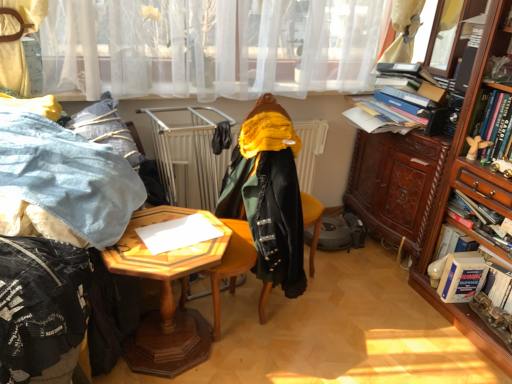
The image size is (512, 384). I want to click on velvet-like green coat at center, so click(x=268, y=198).

This screenshot has width=512, height=384. Describe the element at coordinates (268, 198) in the screenshot. I see `velvet-like green coat at center` at that location.

Where is `velvet black coat at center`? velvet black coat at center is located at coordinates (265, 208).

Looking at this image, how much space does wooden cabinet at right, marked as the second cabinetry in a back-to-front arrangement, occupy vertically?

The height of wooden cabinet at right, marked as the second cabinetry in a back-to-front arrangement, is 4.88 feet.

You are a GUI agent. You are given a task and a screenshot of the screen. Output one action in this format:
    pyautogui.click(x=<x>, y=<y>)
    Task: Click on the wooden hexagonal table at center
    The width and height of the screenshot is (512, 384).
    Given the screenshot: What is the action you would take?
    pyautogui.click(x=166, y=294)

From the image's perspective, which one is positioned lower, hardcover book at right, the 3th book from the bottom, or white sheer curtain at upper center?

From the image's view, hardcover book at right, the 3th book from the bottom, is below.

How much distance is there between hardcover book at right, acting as the 2th book starting from the top, and white sheer curtain at upper center?

A distance of 4.28 feet exists between hardcover book at right, acting as the 2th book starting from the top, and white sheer curtain at upper center.

Is hardcover book at right, the 3th book from the bottom, looking in the opposite direction of white sheer curtain at upper center?

No, hardcover book at right, the 3th book from the bottom, is not facing away from white sheer curtain at upper center.

Would you say hardcover book at right, the 3th book from the bottom, contains white sheer curtain at upper center?

No, white sheer curtain at upper center is not a part of hardcover book at right, the 3th book from the bottom.

Consider the image. Which point is more forward, (465,329) or (478,260)?

The point (478,260) is in front.

How many degrees apart are the facing directions of wooden cabinet at right, acting as the 1th cabinetry starting from the front, and white cardboard book at right, the 2th book positioned from the bottom?

The angle between the facing direction of wooden cabinet at right, acting as the 1th cabinetry starting from the front, and the facing direction of white cardboard book at right, the 2th book positioned from the bottom, is 0.206 degrees.

Who is smaller, wooden cabinet at right, marked as the second cabinetry in a back-to-front arrangement, or white cardboard book at right, the 2th book positioned from the bottom?

white cardboard book at right, the 2th book positioned from the bottom, is smaller.

Is wooden cabinet at right, marked as the second cabinetry in a back-to-front arrangement, situated inside white cardboard book at right, the 2th book positioned from the bottom, or outside?

wooden cabinet at right, marked as the second cabinetry in a back-to-front arrangement, is outside white cardboard book at right, the 2th book positioned from the bottom.

From the image's perspective, starting from the wooden cabinet at right, acting as the 1th cabinetry starting from the front, which book is the 3rd one below? Please provide its 2D coordinates.

[(462, 277)]

Could you tell me if blue cardboard book at lower right, which appears as the 4th book when viewed from the top, is facing wooden cabinet at right, marked as the second cabinetry in a back-to-front arrangement?

Yes, blue cardboard book at lower right, which appears as the 4th book when viewed from the top, is turned towards wooden cabinet at right, marked as the second cabinetry in a back-to-front arrangement.

Is blue cardboard book at lower right, which appears as the first book when ordered from the bottom, at the right side of wooden cabinet at right, marked as the second cabinetry in a back-to-front arrangement?

No.

Is blue cardboard book at lower right, which appears as the 4th book when viewed from the top, spatially inside wooden cabinet at right, marked as the second cabinetry in a back-to-front arrangement, or outside of it?

blue cardboard book at lower right, which appears as the 4th book when viewed from the top, exists entirely within wooden cabinet at right, marked as the second cabinetry in a back-to-front arrangement.

From the picture: Measure the distance between wooden hexagonal table at center and hardcover book at right, the 3th book from the bottom.

wooden hexagonal table at center is 1.43 meters away from hardcover book at right, the 3th book from the bottom.

Is wooden hexagonal table at center surrounding hardcover book at right, the 3th book from the bottom?

No, hardcover book at right, the 3th book from the bottom, is located outside of wooden hexagonal table at center.

Would you consider wooden hexagonal table at center to be distant from hardcover book at right, acting as the 2th book starting from the top?

Indeed, wooden hexagonal table at center is not near hardcover book at right, acting as the 2th book starting from the top.

Between wooden hexagonal table at center and hardcover book at right, acting as the 2th book starting from the top, which one has larger size?

wooden hexagonal table at center.

How distant is hardcover book at right, acting as the 2th book starting from the top, from velvet black coat at center?

hardcover book at right, acting as the 2th book starting from the top, is 37.43 inches away from velvet black coat at center.

Which of these two, hardcover book at right, acting as the 2th book starting from the top, or velvet black coat at center, stands shorter?

Standing shorter between the two is hardcover book at right, acting as the 2th book starting from the top.

Is point (510, 252) in front of point (310, 267)?

Yes, it is.

How different are the orientations of velvet-like green coat at center and dark brown wood cabinet at right, arranged as the 2th cabinetry when viewed from the front, in degrees?

They differ by 96.7 degrees in their facing directions.

In terms of width, does velvet-like green coat at center look wider or thinner when compared to dark brown wood cabinet at right, placed as the first cabinetry when sorted from back to front?

Clearly, velvet-like green coat at center has more width compared to dark brown wood cabinet at right, placed as the first cabinetry when sorted from back to front.

Are velvet-like green coat at center and dark brown wood cabinet at right, arranged as the 2th cabinetry when viewed from the front, beside each other?

No, velvet-like green coat at center is not next to dark brown wood cabinet at right, arranged as the 2th cabinetry when viewed from the front.

Considering the positions of objects velvet-like green coat at center and dark brown wood cabinet at right, arranged as the 2th cabinetry when viewed from the front, in the image provided, who is more to the left, velvet-like green coat at center or dark brown wood cabinet at right, arranged as the 2th cabinetry when viewed from the front,?

velvet-like green coat at center.

From a real-world perspective, does dark brown wood cabinet at right, arranged as the 2th cabinetry when viewed from the front, stand above white cardboard book at right, the third book positioned from the top?

Correct, in the physical world, dark brown wood cabinet at right, arranged as the 2th cabinetry when viewed from the front, is higher than white cardboard book at right, the third book positioned from the top.

Based on the photo, which object is positioned more to the right, dark brown wood cabinet at right, arranged as the 2th cabinetry when viewed from the front, or white cardboard book at right, the 2th book positioned from the bottom?

white cardboard book at right, the 2th book positioned from the bottom.

Does dark brown wood cabinet at right, arranged as the 2th cabinetry when viewed from the front, turn towards white cardboard book at right, the third book positioned from the top?

No, dark brown wood cabinet at right, arranged as the 2th cabinetry when viewed from the front, does not turn towards white cardboard book at right, the third book positioned from the top.

Is the position of dark brown wood cabinet at right, arranged as the 2th cabinetry when viewed from the front, less distant than that of white cardboard book at right, the third book positioned from the top?

No, dark brown wood cabinet at right, arranged as the 2th cabinetry when viewed from the front, is further to the viewer.

Find the location of a particular element. The image size is (512, 384). curtain to the left of hardcover book at right, the 3th book from the bottom is located at coordinates (211, 46).

This screenshot has width=512, height=384. I want to click on the 2nd book directly beneath the wooden cabinet at right, marked as the second cabinetry in a back-to-front arrangement (from a real-world perspective), so click(470, 279).

Considering their positions, is hardcover book at right, which is the 4th book in bottom-to-top order, positioned further to dark brown wood cabinet at right, arranged as the 2th cabinetry when viewed from the front, than velvet-like green coat at center?

The object further to dark brown wood cabinet at right, arranged as the 2th cabinetry when viewed from the front, is velvet-like green coat at center.

Looking at the image, which one is located closer to white cardboard book at right, the third book positioned from the top, velvet black coat at center or hardcover book at right, which is the 4th book in bottom-to-top order?

hardcover book at right, which is the 4th book in bottom-to-top order.

When comparing their distances from wooden hexagonal table at center, does hardcover book at right, the 1th book from the top, or velvet-like green coat at center seem closer?

velvet-like green coat at center.

Looking at the image, which one is located closer to white cardboard book at right, the 2th book positioned from the bottom, velvet-like green coat at center or wooden cabinet at right, marked as the second cabinetry in a back-to-front arrangement?

wooden cabinet at right, marked as the second cabinetry in a back-to-front arrangement, lies closer to white cardboard book at right, the 2th book positioned from the bottom, than the other object.

Looking at this image, looking at the image, which one is located further to blue cardboard book at lower right, which appears as the first book when ordered from the bottom, velvet black coat at center or white sheer curtain at upper center?

Among the two, white sheer curtain at upper center is located further to blue cardboard book at lower right, which appears as the first book when ordered from the bottom.

When comparing their distances from velvet black coat at center, does white cardboard book at right, the 2th book positioned from the bottom, or wooden cabinet at right, marked as the second cabinetry in a back-to-front arrangement, seem closer?

Among the two, white cardboard book at right, the 2th book positioned from the bottom, is located nearer to velvet black coat at center.

Estimate the real-world distances between objects in this image. Which object is closer to velvet black coat at center, velvet-like green coat at center or wooden hexagonal table at center?

velvet-like green coat at center lies closer to velvet black coat at center than the other object.

Based on their spatial positions, is wooden hexagonal table at center or wooden cabinet at right, marked as the second cabinetry in a back-to-front arrangement, further from white sheer curtain at upper center?

wooden hexagonal table at center is further to white sheer curtain at upper center.

This screenshot has height=384, width=512. I want to click on curtain located between wooden hexagonal table at center and white cardboard book at right, the 2th book positioned from the bottom, in the left-right direction, so click(211, 46).

You are a GUI agent. You are given a task and a screenshot of the screen. Output one action in this format:
    pyautogui.click(x=<x>, y=<y>)
    Task: Click on the book between velvet-like green coat at center and hardcover book at right, the 3th book from the bottom, from left to right
    The height and width of the screenshot is (384, 512).
    Given the screenshot: What is the action you would take?
    pyautogui.click(x=462, y=277)

This screenshot has width=512, height=384. I want to click on clothing between white sheer curtain at upper center and velvet black coat at center from top to bottom, so (x=268, y=198).

Where is `desk situated between denim at left and velvet-like green coat at center from left to right`? Image resolution: width=512 pixels, height=384 pixels. desk situated between denim at left and velvet-like green coat at center from left to right is located at coordinates (166, 294).